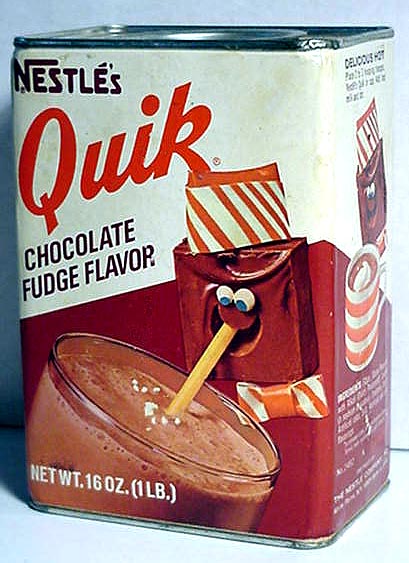
Where is `coffee cup`? coffee cup is located at coordinates [366, 312].